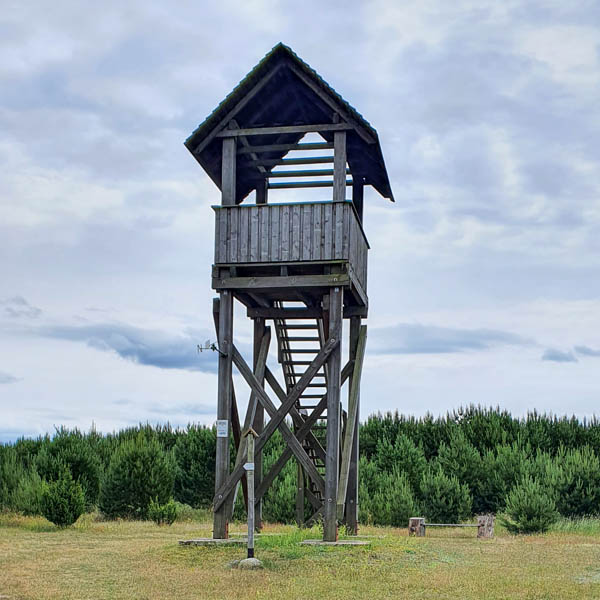
I want to click on bench, so click(443, 523).